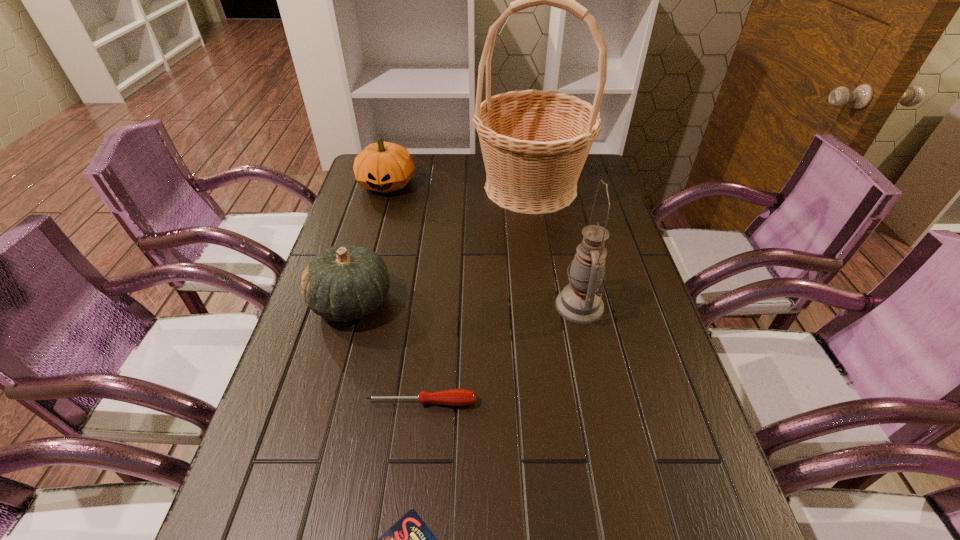
Where is `basket`? Image resolution: width=960 pixels, height=540 pixels. basket is located at coordinates (534, 143).

What are the coordinates of `the fifth shortest object` in the screenshot? It's located at (580, 302).

Where is `the nearer gourd`? the nearer gourd is located at coordinates (343, 283).

Locate an element on the screen. This screenshot has height=540, width=960. the farther gourd is located at coordinates click(x=384, y=167).

Identify the location of screwdriver. The height and width of the screenshot is (540, 960). (453, 397).

Where is `the second nearest object`? the second nearest object is located at coordinates (453, 397).

Identify the location of vacant space situated on the left of the tallest object. The image size is (960, 540). (423, 187).

Identify the location of blank space located 0.230m on the back of the fifth shortest object. The height and width of the screenshot is (540, 960). (564, 231).

Where is `vacant area located on the right of the nearer gourd`? vacant area located on the right of the nearer gourd is located at coordinates (476, 302).

This screenshot has height=540, width=960. I want to click on vacant space located 0.260m on the side of the farther gourd with the carved face, so click(368, 254).